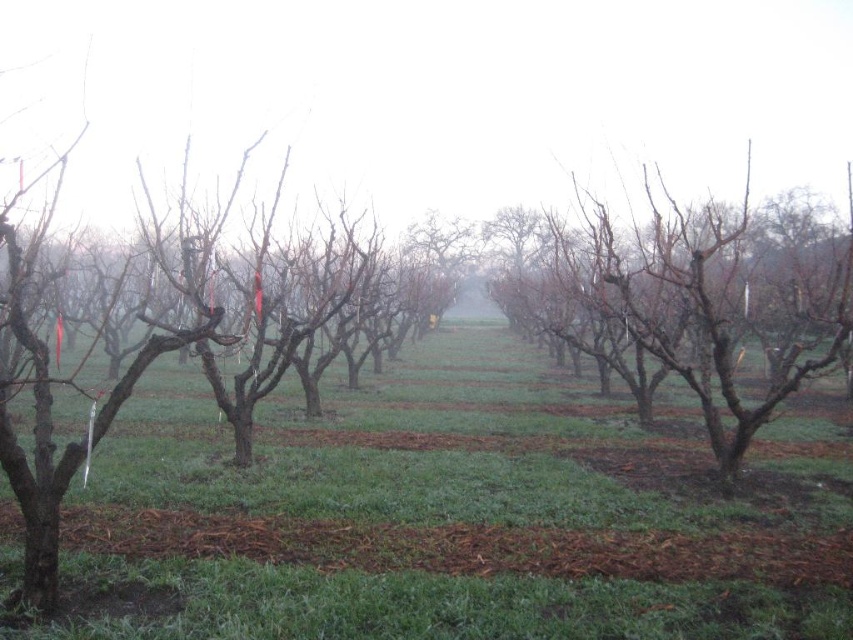
Question: Does green grass at center have a larger size compared to bare branches at center?

Choices:
 (A) no
 (B) yes

Answer: (A)

Question: Which point is farther from the camera taking this photo?

Choices:
 (A) (840, 268)
 (B) (447, 637)

Answer: (A)

Question: Can you confirm if green grass at center is positioned to the left of bare branches at center?

Choices:
 (A) yes
 (B) no

Answer: (A)

Question: Which point appears farthest from the camera in this image?

Choices:
 (A) (701, 381)
 (B) (468, 401)

Answer: (B)

Question: Does green grass at center appear under bare branches at center?

Choices:
 (A) no
 (B) yes

Answer: (B)